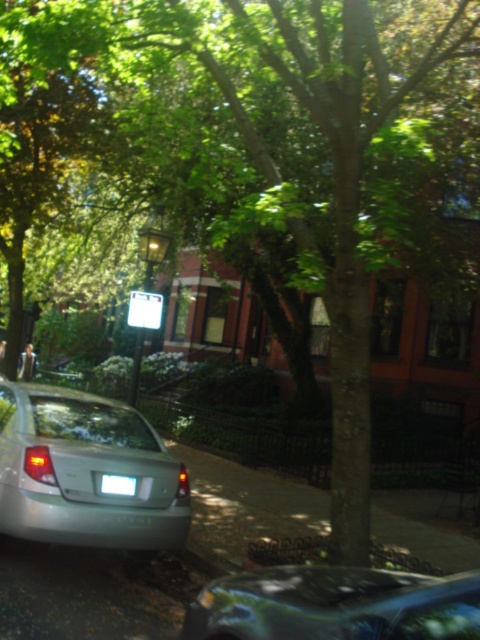
You are a delivery person trying to determine the best path to avoid the satin silver sedan at center and the white plastic license plate at lower center. Which object should you steer around first based on their sizes?

The satin silver sedan at center is bigger than the white plastic license plate at lower center, so you should steer around the satin silver sedan at center first to avoid collision.

You are a delivery person trying to park your van between the satin silver sedan at center and the metallic blue car at lower center. Your van is 5 meters long. Can you fit your van between them?

The satin silver sedan at center is bigger than the metallic blue car at lower center, but the distance between them is not specified. Without knowing the exact spacing between the two vehicles, it is impossible to determine if the van will fit.